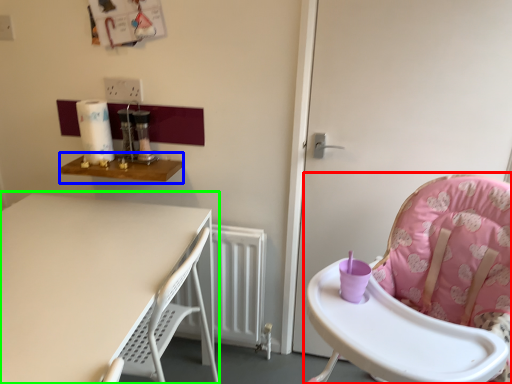
Question: Which object is the farthest from chair (highlighted by a red box)? Choose among these: table (highlighted by a blue box) or table (highlighted by a green box).

Choices:
 (A) table
 (B) table

Answer: (A)